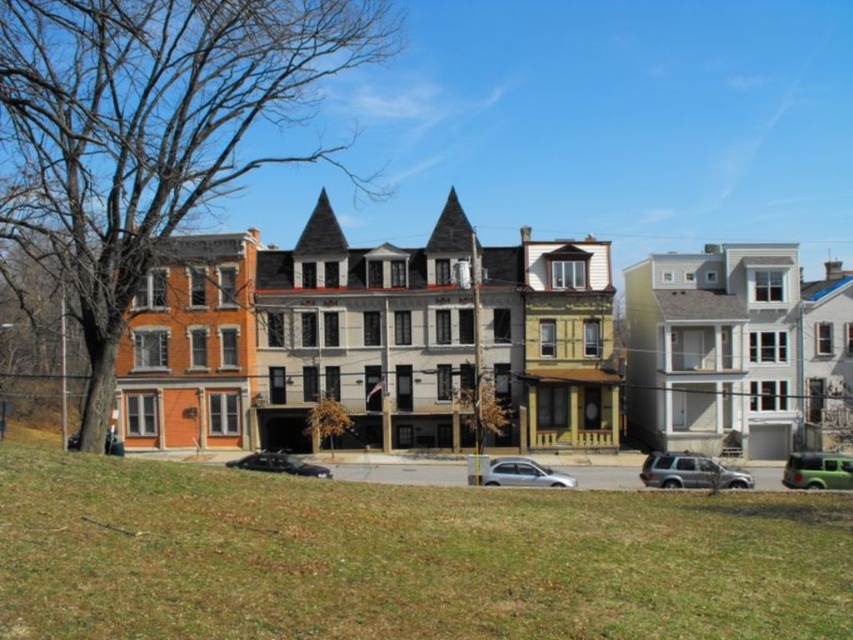
You are standing at the point marked at [722,483] on the map. You need to walk to the nearest residential building. The buildings are located at the following coordinates with their distances from your current position in meters. The orange building is 30 meters away, the light gray buildings are 45 meters away, the yellow building is 25 meters away, and the white building is 50 meters away. Which building should you head towards?

You should head towards the yellow building since it is the closest at 25 meters away from your current position.

Based on the photo, you are a pedestrian standing on the sidewalk in front of the buildings. You see a satin silver suv at center and a black matte car at center. Which car is closer to the orange building on the far left?

The black matte car at center is closer to the orange building on the far left because the satin silver suv at center is to the right of it, placing the black matte car closer to the left side where the orange building is located.

Consider the image. You are a pedestrian standing on the sidewalk and see both the satin silver suv at center and the black matte car at center. Which vehicle is positioned higher relative to the other?

The satin silver suv at center is positioned higher than the black matte car at center.